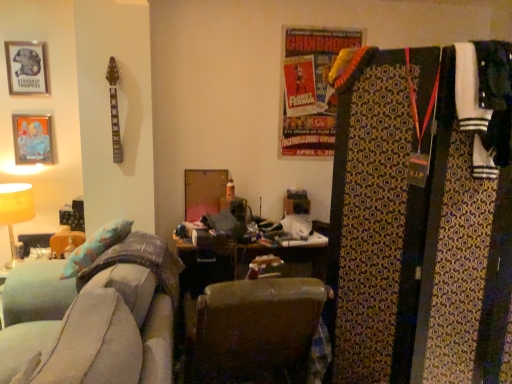
Question: Is leather at center bigger than soft gray fabric couch at lower left?

Choices:
 (A) no
 (B) yes

Answer: (A)

Question: Is leather at center smaller than soft gray fabric couch at lower left?

Choices:
 (A) no
 (B) yes

Answer: (B)

Question: From a real-world perspective, is leather at center located higher than soft gray fabric couch at lower left?

Choices:
 (A) no
 (B) yes

Answer: (A)

Question: From the image's perspective, does leather at center appear higher than soft gray fabric couch at lower left?

Choices:
 (A) no
 (B) yes

Answer: (A)

Question: Is leather at center oriented away from soft gray fabric couch at lower left?

Choices:
 (A) no
 (B) yes

Answer: (A)

Question: From a real-world perspective, is leather at center positioned above or below metallic silver picture frame at upper left, which is the 1th picture frame in bottom-to-top order?

Choices:
 (A) above
 (B) below

Answer: (B)

Question: Relative to metallic silver picture frame at upper left, the 2th picture frame when ordered from top to bottom, is leather at center in front or behind?

Choices:
 (A) behind
 (B) front

Answer: (B)

Question: In the image, is leather at center on the left side or the right side of metallic silver picture frame at upper left, the 2th picture frame when ordered from top to bottom?

Choices:
 (A) left
 (B) right

Answer: (B)

Question: Considering the positions of point (321, 374) and point (16, 117), is point (321, 374) closer or farther from the camera than point (16, 117)?

Choices:
 (A) closer
 (B) farther

Answer: (A)

Question: Considering the positions of point (17, 77) and point (418, 367), is point (17, 77) closer or farther from the camera than point (418, 367)?

Choices:
 (A) farther
 (B) closer

Answer: (A)

Question: Based on their sizes in the image, would you say metallic silver picture frame at upper left, which is counted as the 2th picture frame, starting from the bottom, is bigger or smaller than patterned fabric tie at right?

Choices:
 (A) small
 (B) big

Answer: (A)

Question: Considering the positions of metallic silver picture frame at upper left, placed as the 1th picture frame when sorted from top to bottom, and patterned fabric tie at right in the image, is metallic silver picture frame at upper left, placed as the 1th picture frame when sorted from top to bottom, taller or shorter than patterned fabric tie at right?

Choices:
 (A) short
 (B) tall

Answer: (A)

Question: Looking at their shapes, would you say metallic silver picture frame at upper left, which is counted as the 2th picture frame, starting from the bottom, is wider or thinner than patterned fabric tie at right?

Choices:
 (A) thin
 (B) wide

Answer: (A)

Question: In terms of width, does soft gray fabric couch at lower left look wider or thinner when compared to white jersey at right?

Choices:
 (A) thin
 (B) wide

Answer: (B)

Question: From a real-world perspective, is soft gray fabric couch at lower left above or below white jersey at right?

Choices:
 (A) below
 (B) above

Answer: (A)